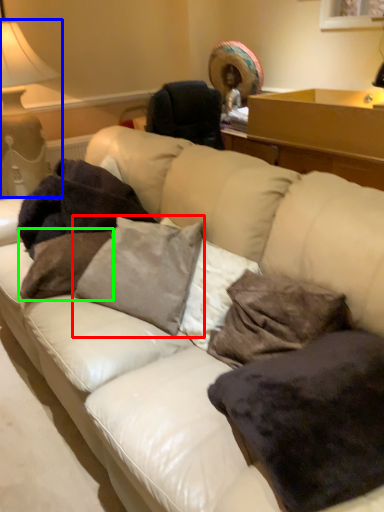
Question: Based on their relative distances, which object is nearer to pillow (highlighted by a red box)? Choose from table lamp (highlighted by a blue box) and pillow (highlighted by a green box).

Choices:
 (A) table lamp
 (B) pillow

Answer: (B)